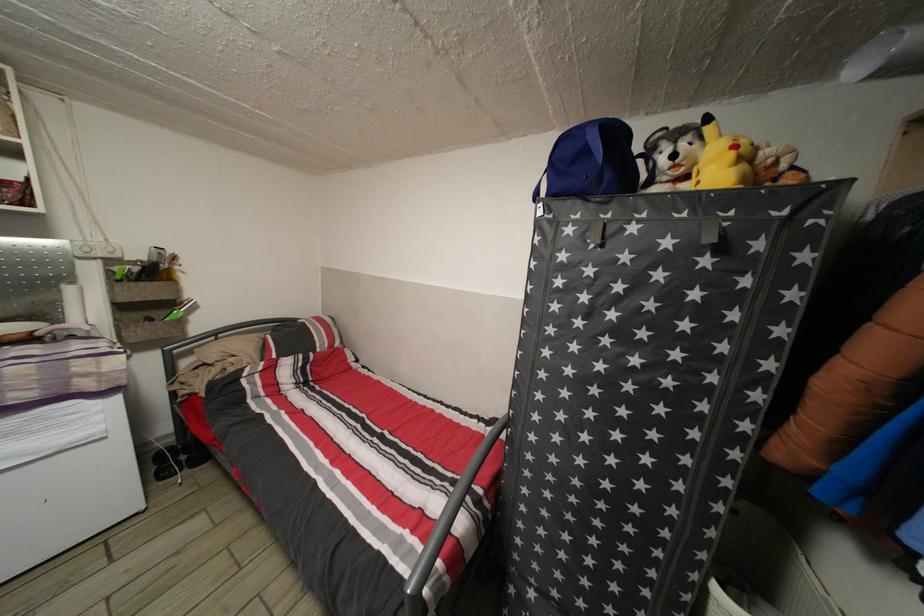
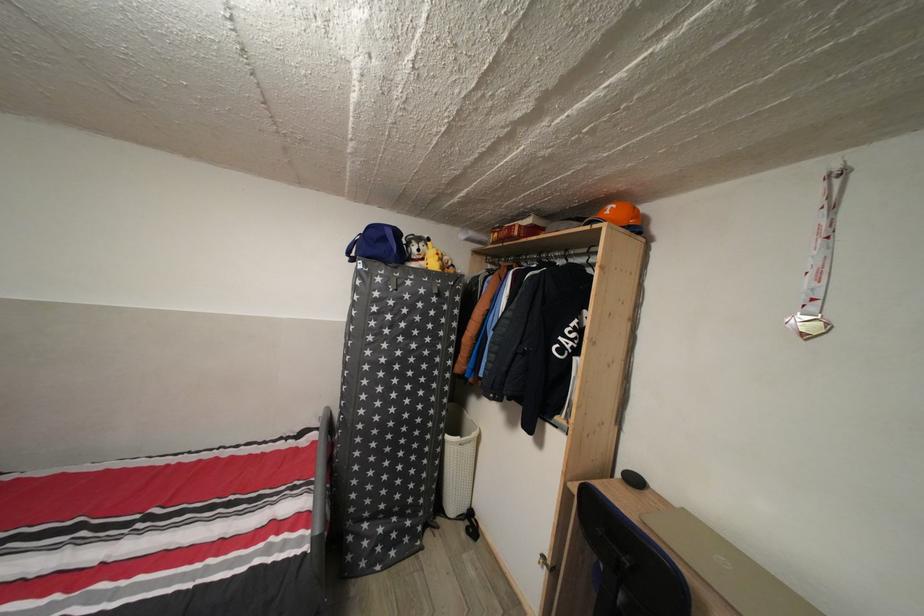
Where in the second image is the point corresponding to [554,501] from the first image?

(380, 451)